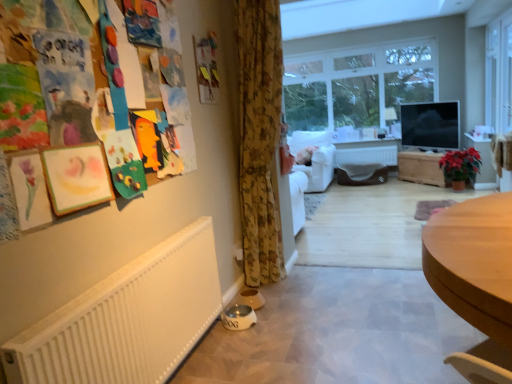
Question: Does white glossy dog bowl at lower left have a smaller size compared to light brown wooden desk at lower right?

Choices:
 (A) yes
 (B) no

Answer: (B)

Question: Does white glossy dog bowl at lower left come behind light brown wooden desk at lower right?

Choices:
 (A) no
 (B) yes

Answer: (B)

Question: Is light brown wooden desk at lower right surrounded by white glossy dog bowl at lower left?

Choices:
 (A) no
 (B) yes

Answer: (A)

Question: Could you tell me if white glossy dog bowl at lower left is facing light brown wooden desk at lower right?

Choices:
 (A) yes
 (B) no

Answer: (B)

Question: Can you confirm if white glossy dog bowl at lower left is positioned to the left of light brown wooden desk at lower right?

Choices:
 (A) no
 (B) yes

Answer: (B)

Question: In the image, is floral fabric curtain at center positioned in front of or behind white matte radiator at center?

Choices:
 (A) behind
 (B) front

Answer: (B)

Question: Is point (267, 130) positioned closer to the camera than point (386, 153)?

Choices:
 (A) closer
 (B) farther

Answer: (A)

Question: In terms of height, does floral fabric curtain at center look taller or shorter compared to white matte radiator at center?

Choices:
 (A) tall
 (B) short

Answer: (A)

Question: Would you say floral fabric curtain at center is inside or outside white matte radiator at center?

Choices:
 (A) outside
 (B) inside

Answer: (A)

Question: Would you say clear glass window at center, which appears as the 1th window when viewed from the back, is to the left or to the right of white matte radiator at center in the picture?

Choices:
 (A) right
 (B) left

Answer: (B)

Question: In terms of height, does clear glass window at center, which is the 2th window from right to left, look taller or shorter compared to white matte radiator at center?

Choices:
 (A) short
 (B) tall

Answer: (B)

Question: Is point pyautogui.click(x=377, y=87) closer or farther from the camera than point pyautogui.click(x=385, y=150)?

Choices:
 (A) closer
 (B) farther

Answer: (A)

Question: Is clear glass window at center, which is the 2th window from right to left, inside the boundaries of white matte radiator at center, or outside?

Choices:
 (A) outside
 (B) inside

Answer: (A)

Question: Is white fabric armchair at center wider or thinner than wooden chest at center?

Choices:
 (A) thin
 (B) wide

Answer: (B)

Question: In terms of height, does white fabric armchair at center look taller or shorter compared to wooden chest at center?

Choices:
 (A) short
 (B) tall

Answer: (B)